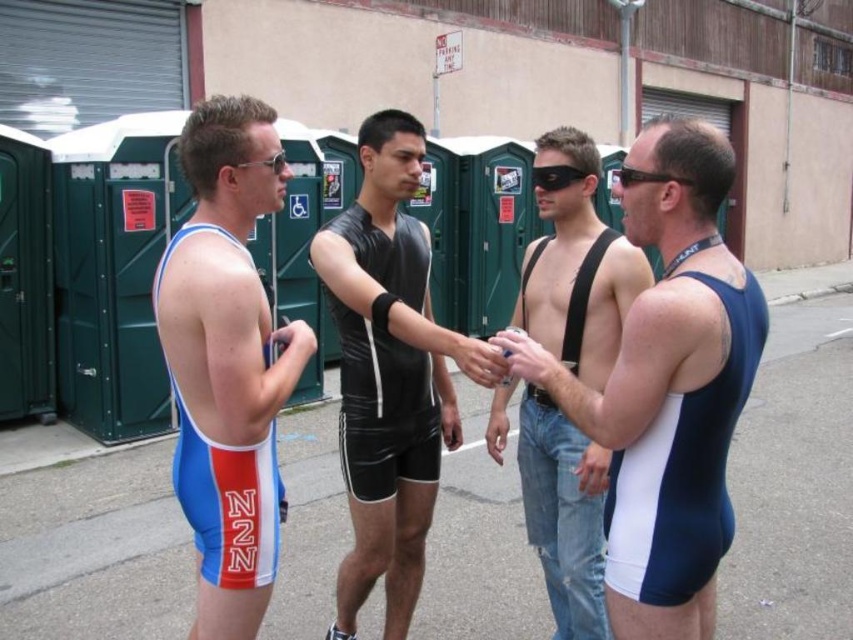
Which of these two, blue/white/red fabric singlet at left or white matte hand at center, stands taller?

blue/white/red fabric singlet at left is taller.

Is blue/white/red fabric singlet at left below white matte hand at center?

No, blue/white/red fabric singlet at left is not below white matte hand at center.

This screenshot has height=640, width=853. I want to click on blue/white/red fabric singlet at left, so click(227, 362).

Which is more to the right, shiny black suit at center or matte black hand at center?

matte black hand at center

Is shiny black suit at center below matte black hand at center?

Indeed, shiny black suit at center is positioned under matte black hand at center.

Is point (381, 564) more distant than point (456, 340)?

Yes, it is behind point (456, 340).

At what (x,y) coordinates should I click in order to perform the action: click on shiny black suit at center. Please return your answer as a coordinate pair (x, y). The width and height of the screenshot is (853, 640). Looking at the image, I should click on (386, 372).

Can you confirm if matte black hand at center is positioned below matte blue skin at center?

Actually, matte black hand at center is above matte blue skin at center.

Image resolution: width=853 pixels, height=640 pixels. Describe the element at coordinates (477, 358) in the screenshot. I see `matte black hand at center` at that location.

The image size is (853, 640). Find the location of `matte black hand at center`. matte black hand at center is located at coordinates (477, 358).